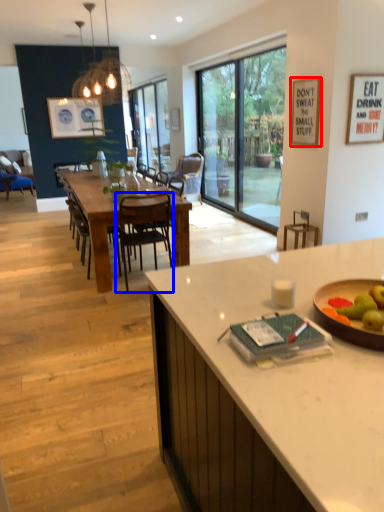
Question: Among these objects, which one is farthest to the camera, picture frame (highlighted by a red box) or chair (highlighted by a blue box)?

Choices:
 (A) picture frame
 (B) chair

Answer: (A)